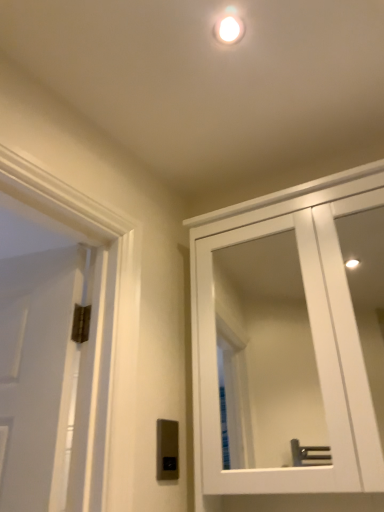
Question: Is satin silver switch at lower center aimed at white glossy droplight at upper center?

Choices:
 (A) yes
 (B) no

Answer: (B)

Question: Does satin silver switch at lower center have a larger size compared to white glossy droplight at upper center?

Choices:
 (A) yes
 (B) no

Answer: (A)

Question: From a real-world perspective, is satin silver switch at lower center positioned over white glossy droplight at upper center based on gravity?

Choices:
 (A) no
 (B) yes

Answer: (A)

Question: From the image's perspective, is satin silver switch at lower center located beneath white glossy droplight at upper center?

Choices:
 (A) no
 (B) yes

Answer: (B)

Question: Is satin silver switch at lower center wider than white glossy droplight at upper center?

Choices:
 (A) yes
 (B) no

Answer: (B)

Question: Considering the positions of white glossy cabinet at upper right and satin silver switch at lower center in the image, is white glossy cabinet at upper right taller or shorter than satin silver switch at lower center?

Choices:
 (A) short
 (B) tall

Answer: (B)

Question: Is point (339, 248) closer or farther from the camera than point (165, 464)?

Choices:
 (A) farther
 (B) closer

Answer: (A)

Question: In terms of size, does white glossy cabinet at upper right appear bigger or smaller than satin silver switch at lower center?

Choices:
 (A) big
 (B) small

Answer: (A)

Question: Is white glossy cabinet at upper right in front of or behind satin silver switch at lower center in the image?

Choices:
 (A) front
 (B) behind

Answer: (A)

Question: From the image's perspective, is white glossy droplight at upper center located above or below satin silver switch at lower center?

Choices:
 (A) below
 (B) above

Answer: (B)

Question: Which is correct: white glossy droplight at upper center is inside satin silver switch at lower center, or outside of it?

Choices:
 (A) outside
 (B) inside

Answer: (A)

Question: Is white glossy droplight at upper center wider or thinner than satin silver switch at lower center?

Choices:
 (A) thin
 (B) wide

Answer: (B)

Question: Based on their positions, is white glossy droplight at upper center located to the left or right of satin silver switch at lower center?

Choices:
 (A) left
 (B) right

Answer: (B)

Question: From their relative heights in the image, would you say white glossy cabinet at upper right is taller or shorter than white glossy droplight at upper center?

Choices:
 (A) tall
 (B) short

Answer: (A)

Question: Considering the positions of white glossy cabinet at upper right and white glossy droplight at upper center in the image, is white glossy cabinet at upper right wider or thinner than white glossy droplight at upper center?

Choices:
 (A) thin
 (B) wide

Answer: (B)